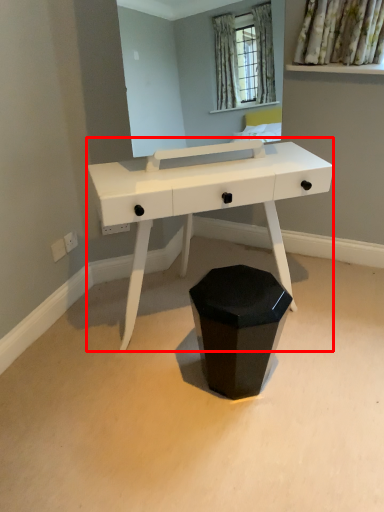
Question: From the image's perspective, what is the correct spatial relationship of table (annotated by the red box) in relation to waste container?

Choices:
 (A) above
 (B) below

Answer: (A)